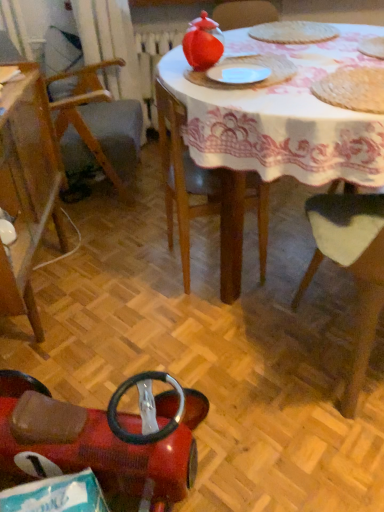
Image resolution: width=384 pixels, height=512 pixels. What are the coordinates of `free spot to the right of white matte paper plate at center` in the screenshot? It's located at (301, 75).